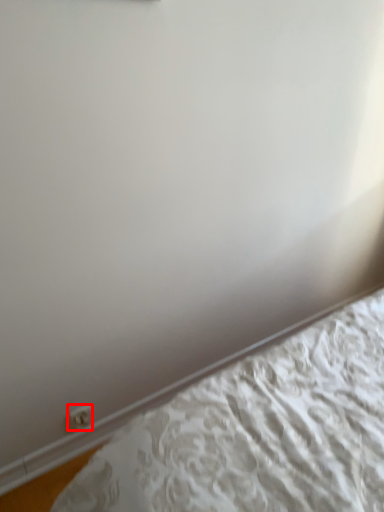
Question: From the image's perspective, where is electric outlet (annotated by the red box) located in relation to bed in the image?

Choices:
 (A) above
 (B) below

Answer: (B)